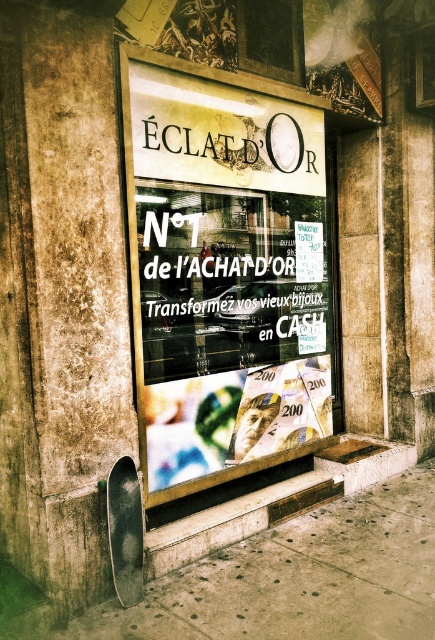
Question: Which of these objects is positioned closest to the smooth concrete pavement at lower left?

Choices:
 (A) matte glass shop window at center
 (B) white paper at center
 (C) metallic gray skateboard at lower left

Answer: (C)

Question: Which point appears farthest from the camera in this image?

Choices:
 (A) (324, 602)
 (B) (143, 595)
 (C) (307, 260)

Answer: (C)

Question: Does smooth concrete pavement at lower left have a smaller size compared to metallic gray skateboard at lower left?

Choices:
 (A) no
 (B) yes

Answer: (A)

Question: Is white paper at center bigger than metallic gray skateboard at lower left?

Choices:
 (A) no
 (B) yes

Answer: (B)

Question: Can you confirm if matte glass shop window at center is wider than white paper at center?

Choices:
 (A) yes
 (B) no

Answer: (A)

Question: Which object is closer to the camera taking this photo?

Choices:
 (A) smooth concrete pavement at lower left
 (B) matte glass shop window at center
 (C) white paper at center
 (D) metallic gray skateboard at lower left

Answer: (A)